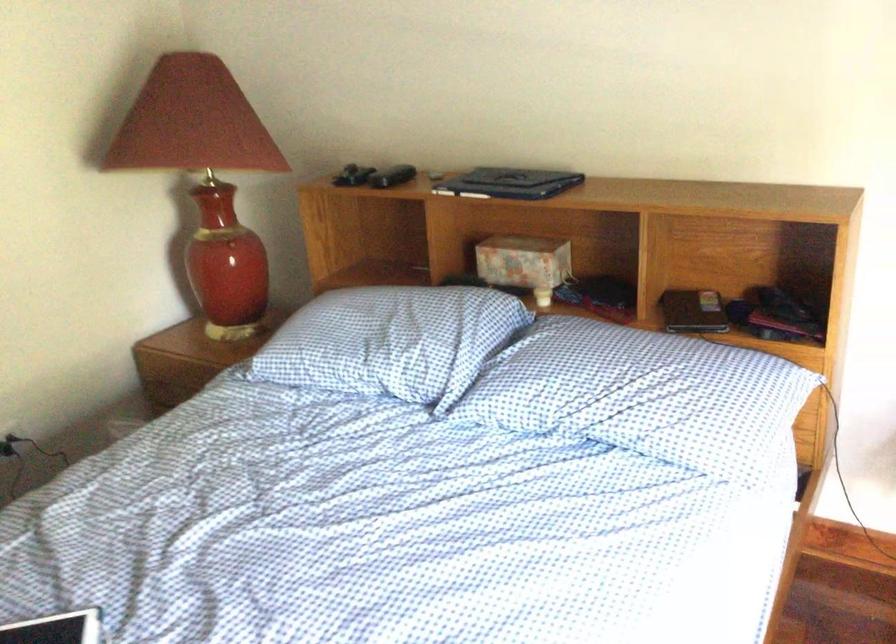
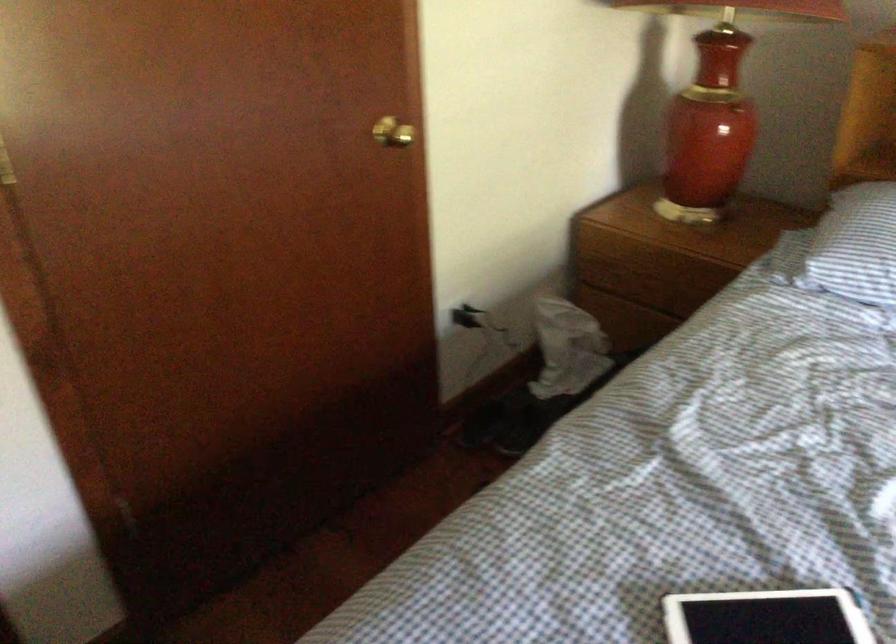
In the second image, find the point that corresponds to point 184,386 in the first image.

(650, 283)